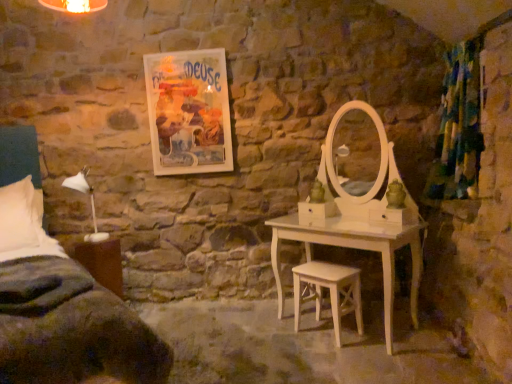
Question: In terms of width, does dark green fabric bed at left look wider or thinner when compared to matte paper poster at upper center?

Choices:
 (A) thin
 (B) wide

Answer: (B)

Question: From their relative heights in the image, would you say dark green fabric bed at left is taller or shorter than matte paper poster at upper center?

Choices:
 (A) short
 (B) tall

Answer: (B)

Question: Which object is the farthest from the textured green curtain at right?

Choices:
 (A) matte paper poster at upper center
 (B) dark green fabric bed at left
 (C) brown wood nightstand at lower left
 (D) white wood stool at center
 (E) white matte table lamp at left

Answer: (E)

Question: Considering the real-world distances, which object is farthest from the white matte table lamp at left?

Choices:
 (A) white wood stool at center
 (B) dark green fabric bed at left
 (C) textured green curtain at right
 (D) matte paper poster at upper center
 (E) brown wood nightstand at lower left

Answer: (C)